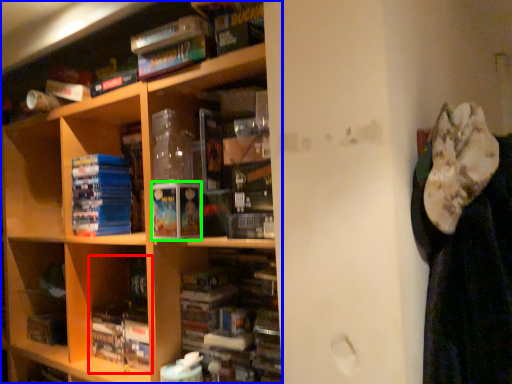
Question: Estimate the real-world distances between objects in this image. Which object is closer to book (highlighted by a red box), shelf (highlighted by a blue box) or paperback book (highlighted by a green box)?

Choices:
 (A) shelf
 (B) paperback book

Answer: (A)